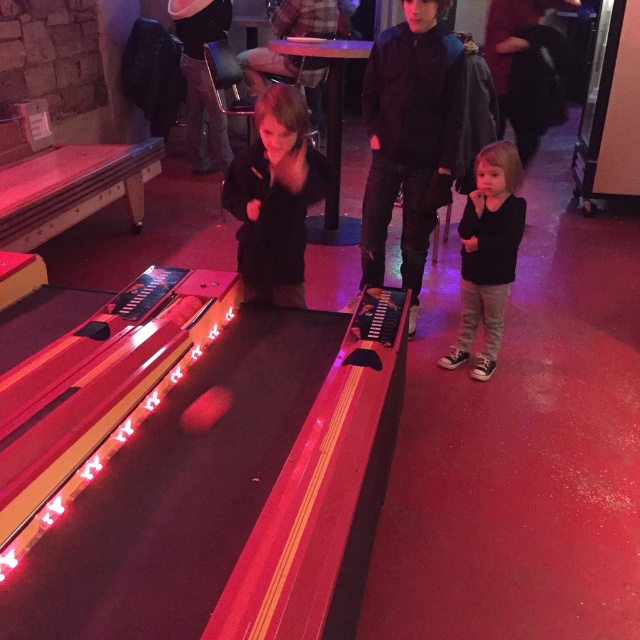
Does black matte jacket at center have a greater width compared to black matte shirt at right?

Yes, black matte jacket at center is wider than black matte shirt at right.

Does point (308, 180) come closer to viewer compared to point (493, 316)?

That is True.

Image resolution: width=640 pixels, height=640 pixels. I want to click on black matte jacket at center, so click(275, 196).

Can you confirm if dark blue jacket at center is shorter than black matte shirt at right?

In fact, dark blue jacket at center may be taller than black matte shirt at right.

Between dark blue jacket at center and black matte shirt at right, which one has more height?

Standing taller between the two is dark blue jacket at center.

In order to click on dark blue jacket at center in this screenshot , I will do `click(410, 138)`.

Does dark blue jacket at center have a greater width compared to black matte jacket at center?

Correct, the width of dark blue jacket at center exceeds that of black matte jacket at center.

Between dark blue jacket at center and black matte jacket at center, which one has less height?

With less height is black matte jacket at center.

Describe the element at coordinates (410, 138) in the screenshot. The height and width of the screenshot is (640, 640). I see `dark blue jacket at center` at that location.

This screenshot has height=640, width=640. In order to click on dark blue jacket at center in this screenshot , I will do `click(410, 138)`.